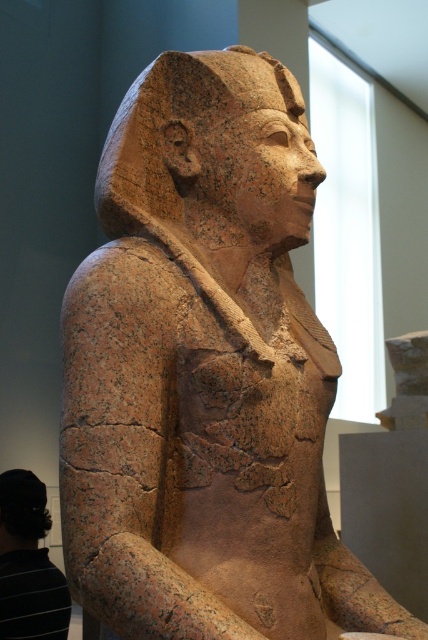
Question: Among these objects, which one is farthest from the camera?

Choices:
 (A) matte brown statue head at center
 (B) black striped shirt at lower left
 (C) granite statue at center

Answer: (A)

Question: Can you confirm if granite statue at center is positioned to the right of matte brown statue head at center?

Choices:
 (A) no
 (B) yes

Answer: (B)

Question: Considering the real-world distances, which object is closest to the matte brown statue head at center?

Choices:
 (A) black striped shirt at lower left
 (B) granite statue at center

Answer: (A)

Question: Does black striped shirt at lower left have a greater width compared to matte brown statue head at center?

Choices:
 (A) no
 (B) yes

Answer: (B)

Question: Does granite statue at center have a larger size compared to black striped shirt at lower left?

Choices:
 (A) yes
 (B) no

Answer: (B)

Question: Which is nearer to the matte brown statue head at center?

Choices:
 (A) granite statue at center
 (B) black striped shirt at lower left

Answer: (B)